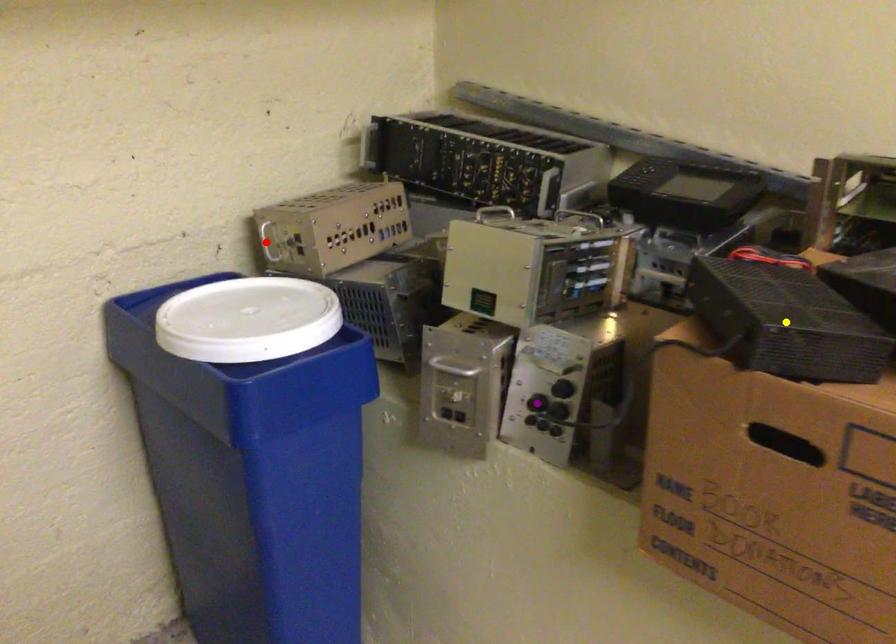
Order these from nearest to farthest:
- yellow point
- purple point
- red point

red point
purple point
yellow point